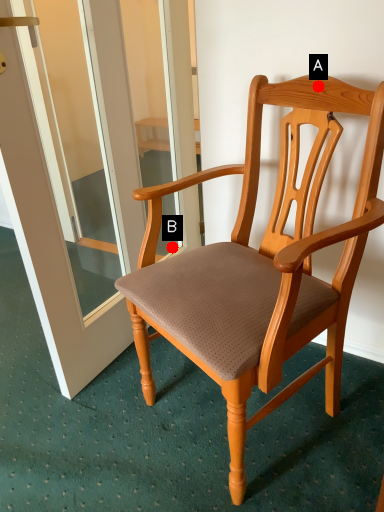
Question: Two points are circled on the image, labeled by A and B beside each circle. Among these points, which one is farthest from the camera?

Choices:
 (A) A is further
 (B) B is further

Answer: (B)